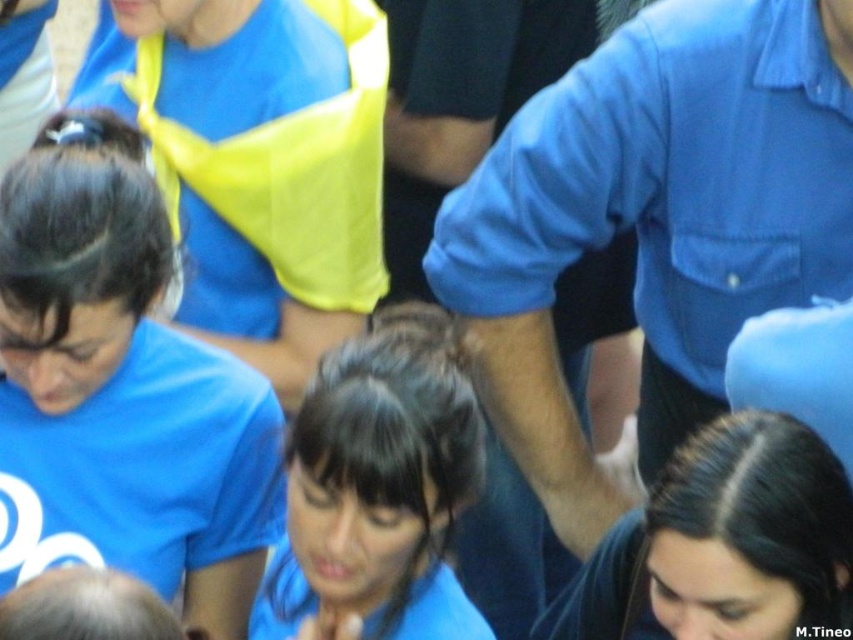
Question: Is blue shirt at upper center below blue matte shirt at center?

Choices:
 (A) yes
 (B) no

Answer: (B)

Question: Among these points, which one is farthest from the camera?

Choices:
 (A) (396, 404)
 (B) (769, 168)

Answer: (B)

Question: From the image, what is the correct spatial relationship of blue shirt at upper center in relation to dark blue hair at center?

Choices:
 (A) below
 (B) above

Answer: (B)

Question: Can you confirm if blue shirt at upper center is positioned below dark blue hair at center?

Choices:
 (A) no
 (B) yes

Answer: (A)

Question: Which of the following is the closest to the observer?

Choices:
 (A) (73, 236)
 (B) (289, 506)
 (C) (786, 536)

Answer: (C)

Question: Which point is closer to the camera?

Choices:
 (A) (0, 193)
 (B) (664, 634)
 (C) (346, 467)

Answer: (C)